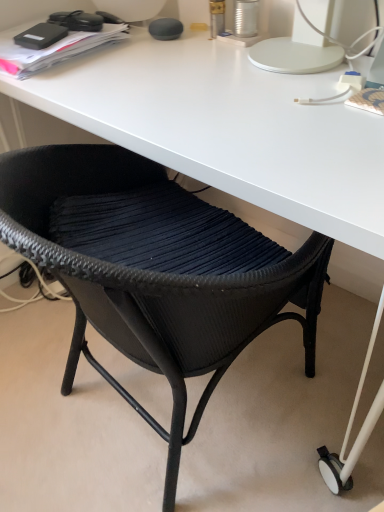
Image resolution: width=384 pixels, height=512 pixels. Identify the location of free point below black woven chair at lower center (from a real-world perspective). (133, 422).